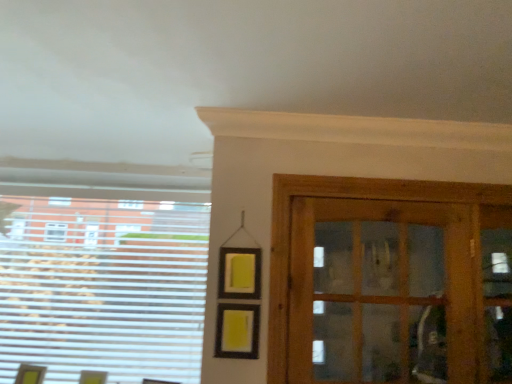
Question: Is wooden cabinet at right situated inside white plastic blinds at left or outside?

Choices:
 (A) inside
 (B) outside

Answer: (B)

Question: Based on their sizes in the image, would you say wooden cabinet at right is bigger or smaller than white plastic blinds at left?

Choices:
 (A) big
 (B) small

Answer: (A)

Question: From a real-world perspective, is wooden cabinet at right positioned above or below white plastic blinds at left?

Choices:
 (A) above
 (B) below

Answer: (A)

Question: From the image's perspective, is white plastic blinds at left positioned above or below wooden cabinet at right?

Choices:
 (A) below
 (B) above

Answer: (A)

Question: Does point (185, 337) appear closer or farther from the camera than point (465, 236)?

Choices:
 (A) closer
 (B) farther

Answer: (B)

Question: Is white plastic blinds at left situated inside wooden cabinet at right or outside?

Choices:
 (A) inside
 (B) outside

Answer: (B)

Question: In the image, is white plastic blinds at left positioned in front of or behind wooden cabinet at right?

Choices:
 (A) front
 (B) behind

Answer: (B)